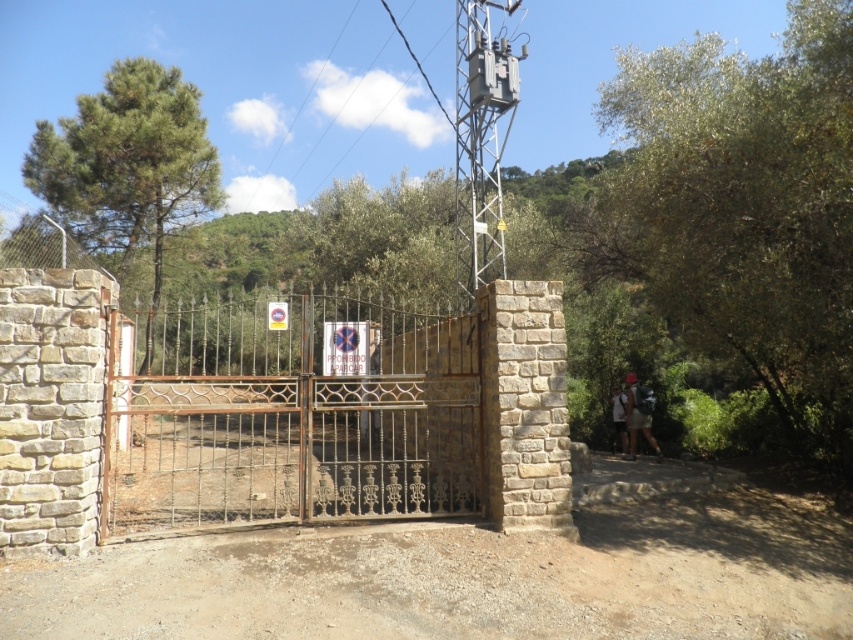
Is rusty metal gate at center thinner than green leafy tree at upper left?

Incorrect, rusty metal gate at center's width is not less than green leafy tree at upper left's.

In order to click on rusty metal gate at center in this screenshot , I will do `click(294, 420)`.

Describe the element at coordinates (294, 420) in the screenshot. I see `rusty metal gate at center` at that location.

Does point (405, 328) come farther from viewer compared to point (612, 420)?

Yes, it is.

Is point (207, 488) farther from camera compared to point (616, 406)?

No, it is not.

Identify the location of rusty metal gate at center. (294, 420).

Based on the photo, does green leafy tree at upper left have a greater height compared to matte red backpack at right?

In fact, green leafy tree at upper left may be shorter than matte red backpack at right.

At what (x,y) coordinates should I click in order to perform the action: click on green leafy tree at upper left. Please return your answer as a coordinate pair (x, y). Looking at the image, I should click on (126, 163).